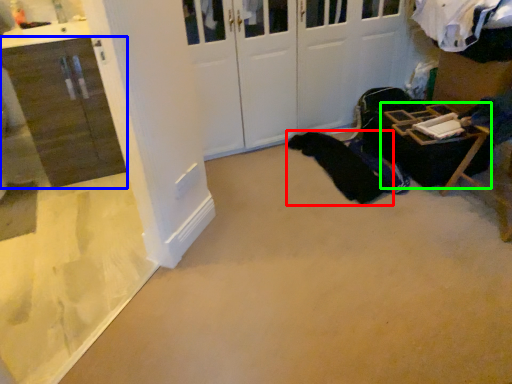
Question: Estimate the real-world distances between objects in this image. Which object is farther from clothing (highlighted by a red box), cabinetry (highlighted by a blue box) or furniture (highlighted by a green box)?

Choices:
 (A) cabinetry
 (B) furniture

Answer: (A)